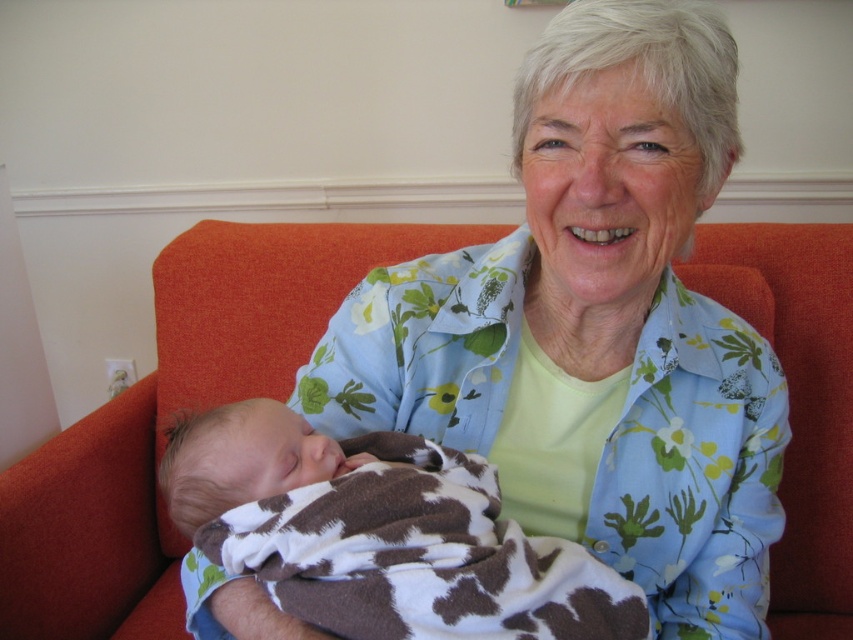
Question: Which point is farther to the camera?

Choices:
 (A) cowprint fabric newborn at lower left
 (B) floral shirt at center
 (C) orange fabric couch at center

Answer: (C)

Question: Considering the real-world distances, which object is farthest from the floral shirt at center?

Choices:
 (A) orange fabric couch at center
 (B) cowprint fabric newborn at lower left

Answer: (A)

Question: Can you confirm if floral shirt at center is wider than cowprint fabric newborn at lower left?

Choices:
 (A) yes
 (B) no

Answer: (A)

Question: Is floral shirt at center thinner than cowprint fabric newborn at lower left?

Choices:
 (A) yes
 (B) no

Answer: (B)

Question: Which object appears closest to the camera in this image?

Choices:
 (A) cowprint fabric newborn at lower left
 (B) orange fabric couch at center
 (C) floral shirt at center

Answer: (A)

Question: In this image, where is floral shirt at center located relative to orange fabric couch at center?

Choices:
 (A) above
 (B) below

Answer: (A)